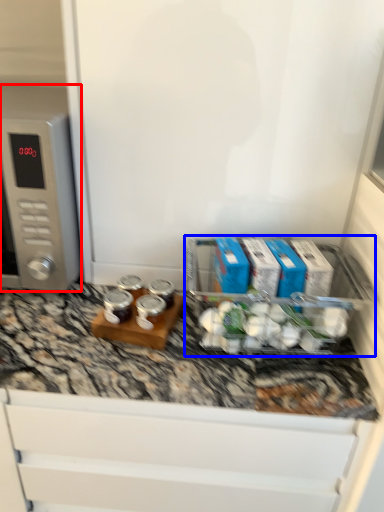
Question: Which object is closer to the camera taking this photo, home appliance (highlighted by a red box) or appliance (highlighted by a blue box)?

Choices:
 (A) home appliance
 (B) appliance

Answer: (B)